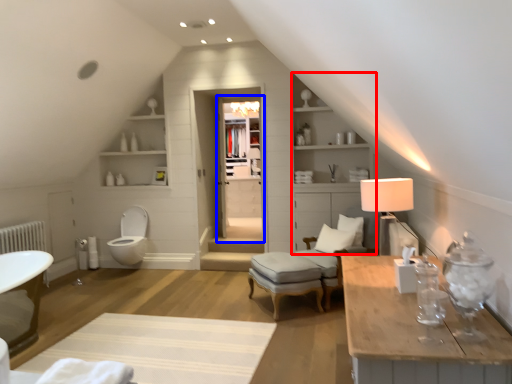
Question: Which point is further to the camera, dresser (highlighted by a red box) or glass door (highlighted by a blue box)?

Choices:
 (A) dresser
 (B) glass door

Answer: (B)